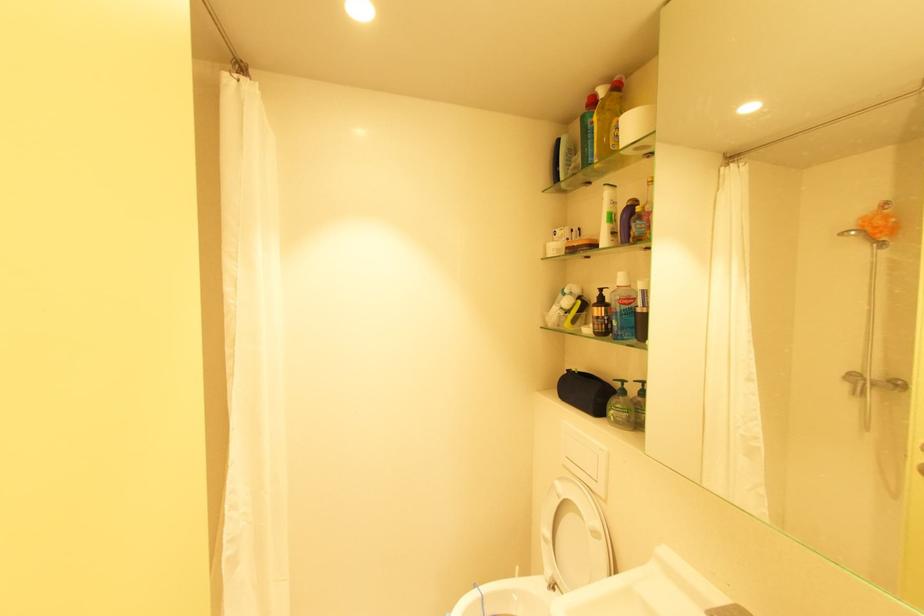
Where is `yellow cleaner bottle`? The width and height of the screenshot is (924, 616). yellow cleaner bottle is located at coordinates (608, 118).